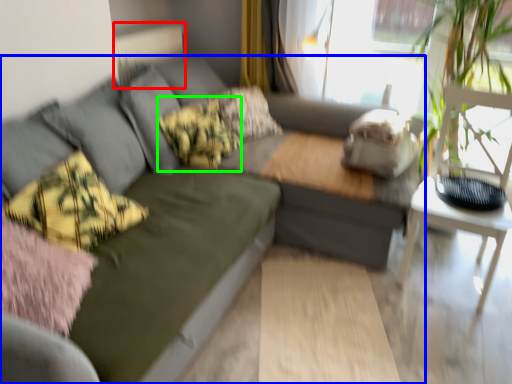
Question: Estimate the real-world distances between objects in this image. Which object is farther from radiator (highlighted by a red box), studio couch (highlighted by a blue box) or pillow (highlighted by a green box)?

Choices:
 (A) studio couch
 (B) pillow

Answer: (A)